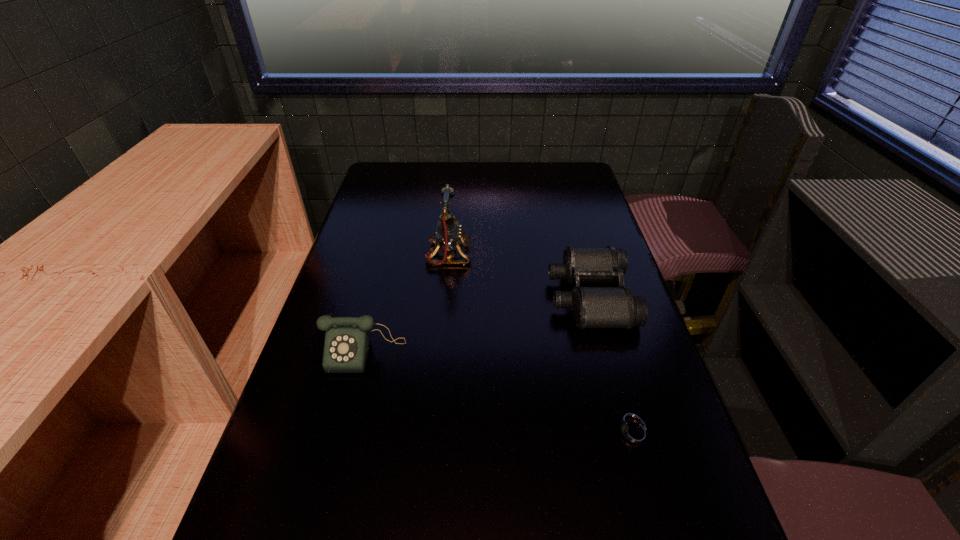
This screenshot has width=960, height=540. I want to click on vacant space located 0.050m through the eyepieces of the binoculars, so click(532, 296).

Identify the location of vacant space positioned on the dial of the left telephone. The height and width of the screenshot is (540, 960). (329, 491).

Image resolution: width=960 pixels, height=540 pixels. In order to click on vacant space located on the face of the watch in this screenshot , I will do `click(437, 433)`.

Where is `free space located 0.090m on the face of the watch`? free space located 0.090m on the face of the watch is located at coordinates (561, 433).

Locate an element on the screen. This screenshot has height=540, width=960. vacant position located on the face of the watch is located at coordinates (432, 433).

Image resolution: width=960 pixels, height=540 pixels. In order to click on object that is at the left edge in this screenshot , I will do `click(347, 344)`.

Find the location of a particular element. This screenshot has width=960, height=540. binoculars at the right edge is located at coordinates (592, 307).

This screenshot has height=540, width=960. In order to click on watch located at the right edge in this screenshot , I will do `click(634, 434)`.

In the image, there is a desktop. At what (x,y) coordinates should I click in order to perform the action: click on vacant space at the far edge. Please return your answer as a coordinate pair (x, y). This screenshot has width=960, height=540. Looking at the image, I should click on (544, 188).

Where is `vacant space at the left edge of the desktop`? The width and height of the screenshot is (960, 540). vacant space at the left edge of the desktop is located at coordinates point(372,193).